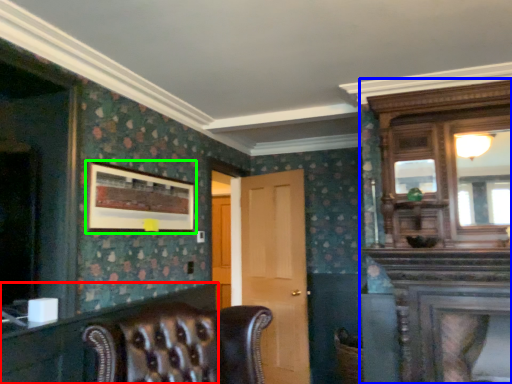
Question: Which object is positioned farthest from dresser (highlighted by a red box)? Select from dresser (highlighted by a blue box) and picture frame (highlighted by a green box).

Choices:
 (A) dresser
 (B) picture frame

Answer: (A)